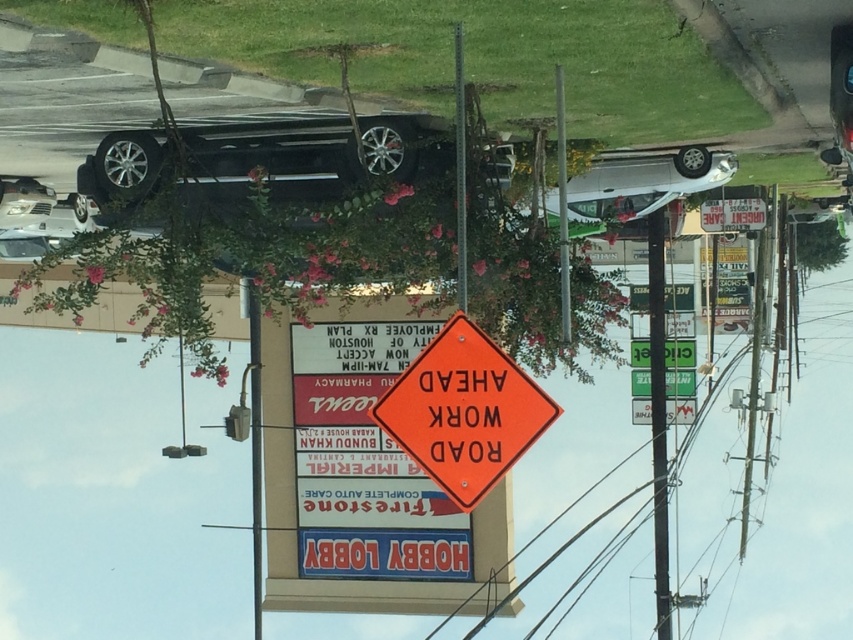
You are driving a car that is 4 meters long. You see the white matte car at upper right and the orange plastic diamond at center in your view. Can your car fit between them without touching either?

The white matte car at upper right and orange plastic diamond at center are 13.13 meters apart. Since your car is only 4 meters long, there is enough space between them for your car to fit without touching either.